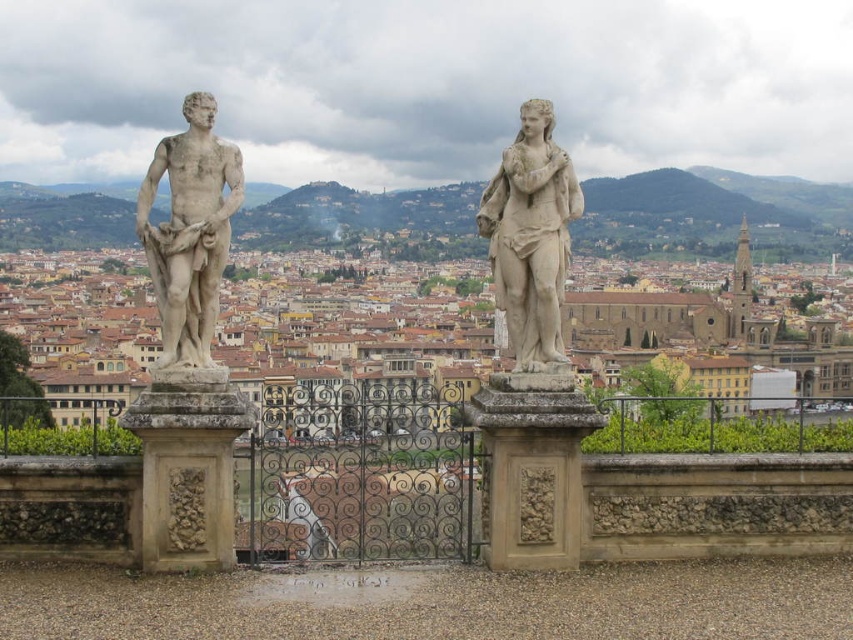
Does white marble statue at left have a greater width compared to white marble statue at center?

No, white marble statue at left is not wider than white marble statue at center.

Is point (189, 100) behind point (566, 195)?

That is True.

This screenshot has width=853, height=640. Find the location of `white marble statue at left`. white marble statue at left is located at coordinates (190, 230).

Locate an element on the screen. Image resolution: width=853 pixels, height=640 pixels. white marble statue at left is located at coordinates (190, 230).